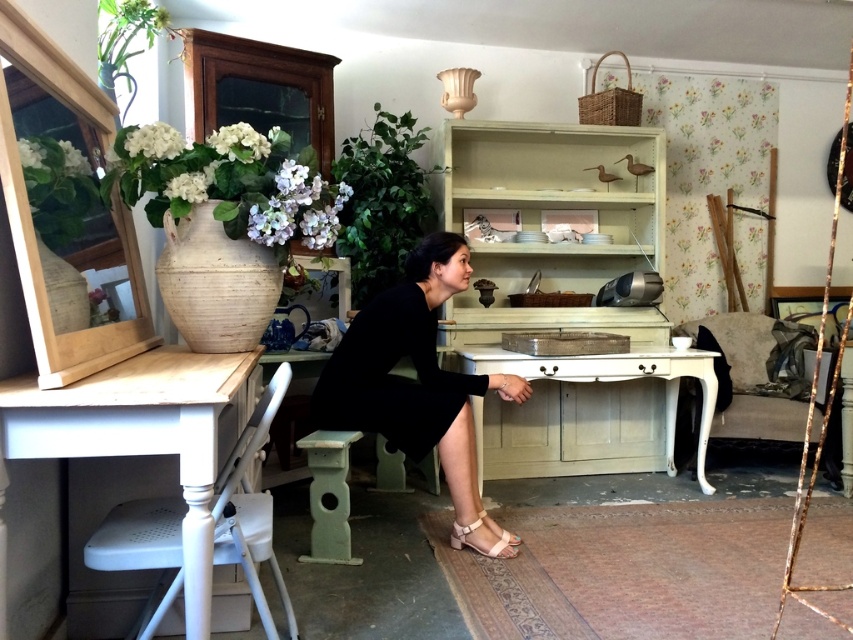
How far apart are white painted wood chair at lower left and beige leather sandal at lower center?

white painted wood chair at lower left and beige leather sandal at lower center are 1.10 meters apart from each other.

Does white painted wood chair at lower left have a greater width compared to beige leather sandal at lower center?

Yes.

Locate an element on the screen. white painted wood chair at lower left is located at coordinates (251, 508).

Does black matte dress at center appear under velvet beige sofa at right?

No.

Does black matte dress at center appear over velvet beige sofa at right?

Correct, black matte dress at center is located above velvet beige sofa at right.

Between point (395, 419) and point (717, 412), which one is positioned behind?

Point (717, 412)

The width and height of the screenshot is (853, 640). What are the coordinates of `black matte dress at center` in the screenshot? It's located at (416, 371).

This screenshot has width=853, height=640. What do you see at coordinates (749, 380) in the screenshot?
I see `velvet beige sofa at right` at bounding box center [749, 380].

Consider the image. Does velvet beige sofa at right appear on the right side of matte beige sandal at lower center?

Yes, velvet beige sofa at right is to the right of matte beige sandal at lower center.

Is point (722, 342) farther from viewer compared to point (480, 515)?

Yes, point (722, 342) is behind point (480, 515).

You are a GUI agent. You are given a task and a screenshot of the screen. Output one action in this format:
    pyautogui.click(x=<x>, y=<y>)
    Task: Click on the velvet beige sofa at right
    This screenshot has width=853, height=640.
    Given the screenshot: What is the action you would take?
    749,380